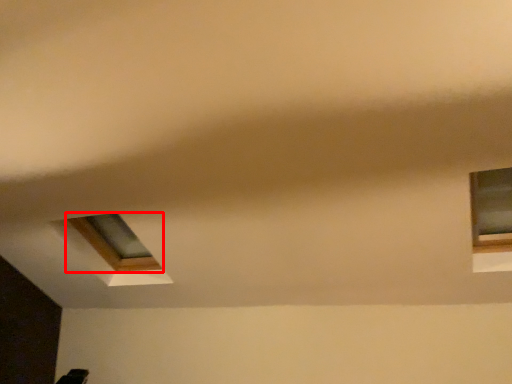
Question: Where is window (annotated by the red box) located in relation to window in the image?

Choices:
 (A) right
 (B) left

Answer: (B)